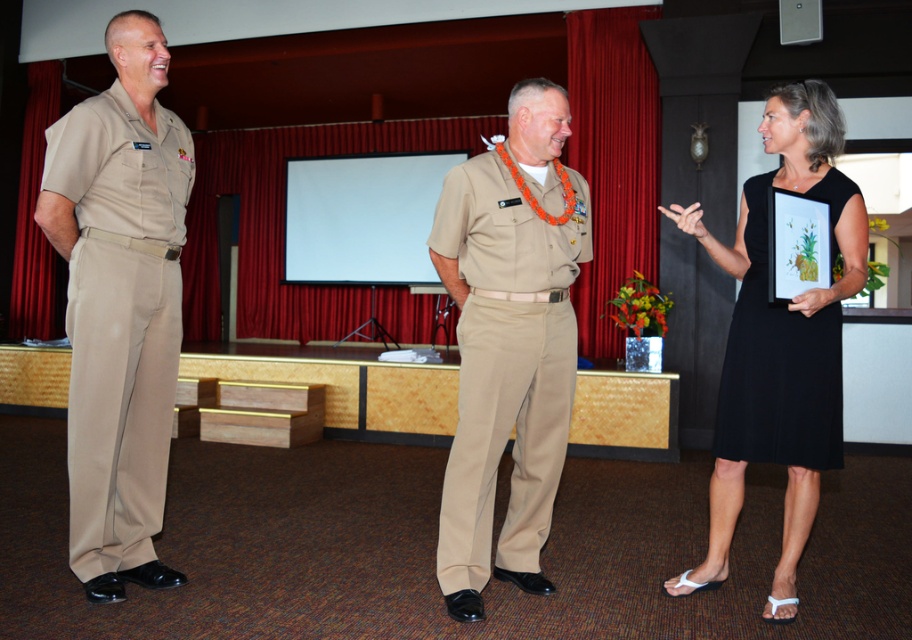
Who is more distant from viewer, [814,428] or [750,230]?

The point [750,230] is behind.

Is black fabric dress at upper right smaller than black satin dress at right?

No, black fabric dress at upper right is not smaller than black satin dress at right.

What do you see at coordinates (780, 340) in the screenshot? The height and width of the screenshot is (640, 912). I see `black fabric dress at upper right` at bounding box center [780, 340].

The height and width of the screenshot is (640, 912). What are the coordinates of `black fabric dress at upper right` in the screenshot? It's located at (780, 340).

Measure the distance between tan cotton pants at left and black satin dress at right.

A distance of 2.27 meters exists between tan cotton pants at left and black satin dress at right.

What do you see at coordinates (120, 317) in the screenshot? I see `tan cotton pants at left` at bounding box center [120, 317].

What do you see at coordinates (120, 317) in the screenshot? I see `tan cotton pants at left` at bounding box center [120, 317].

Where is `tan cotton pants at left`? tan cotton pants at left is located at coordinates (120, 317).

Between point (164, 120) and point (782, 614), which one is positioned in front?

Point (782, 614) is more forward.

Does tan cotton pants at left appear over black fabric dress at upper right?

Correct, tan cotton pants at left is located above black fabric dress at upper right.

Who is more forward, [141,401] or [865,237]?

Point [865,237] is in front.

This screenshot has width=912, height=640. I want to click on tan cotton pants at left, so click(x=120, y=317).